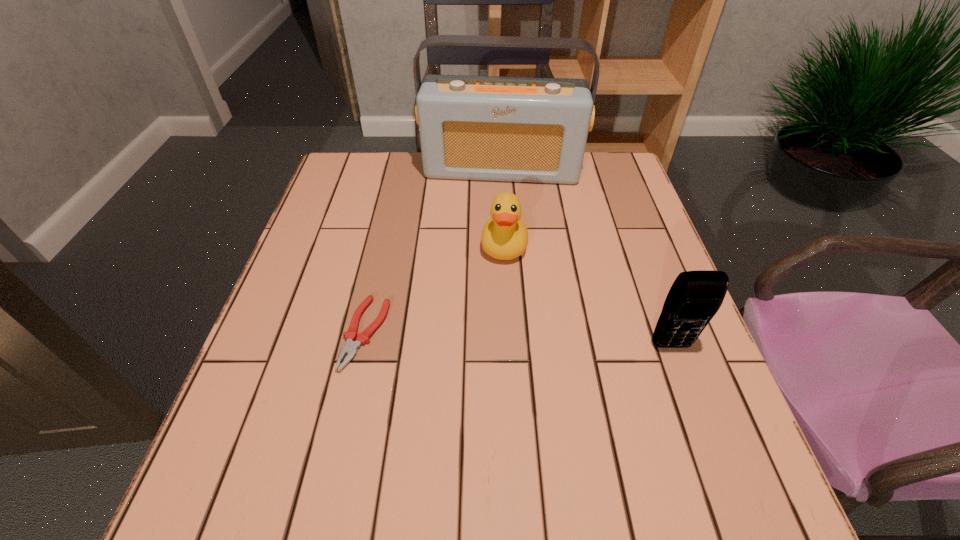
In order to click on vacant space at the far edge of the desktop in this screenshot , I will do `click(397, 157)`.

In the image, there is a desktop. What are the coordinates of `vacant space at the near edge` in the screenshot? It's located at (468, 426).

Identify the location of vacant position at the left edge of the desktop. Image resolution: width=960 pixels, height=540 pixels. (313, 264).

The width and height of the screenshot is (960, 540). In the image, there is a desktop. Identify the location of vacant region at the right edge. (603, 237).

In the image, there is a desktop. Identify the location of vacant space at the far left corner. This screenshot has height=540, width=960. (360, 166).

You are a GUI agent. You are given a task and a screenshot of the screen. Output one action in this format:
    pyautogui.click(x=<x>, y=<y>)
    Task: Click on the free location at the far right corner of the desktop
    
    Given the screenshot: What is the action you would take?
    pyautogui.click(x=616, y=161)

At what (x,y) coordinates should I click in order to perform the action: click on free space between the second tallest object and the second shortest object. Please return your answer as a coordinate pair (x, y). This screenshot has height=540, width=960. Looking at the image, I should click on (588, 295).

In order to click on free spot between the rightmost object and the duck in this screenshot , I will do `click(588, 295)`.

Identify the location of free area in between the leftmost object and the duck. The width and height of the screenshot is (960, 540). (435, 289).

Where is `vacant space that is in between the tallest object and the cellular telephone`? vacant space that is in between the tallest object and the cellular telephone is located at coordinates (587, 258).